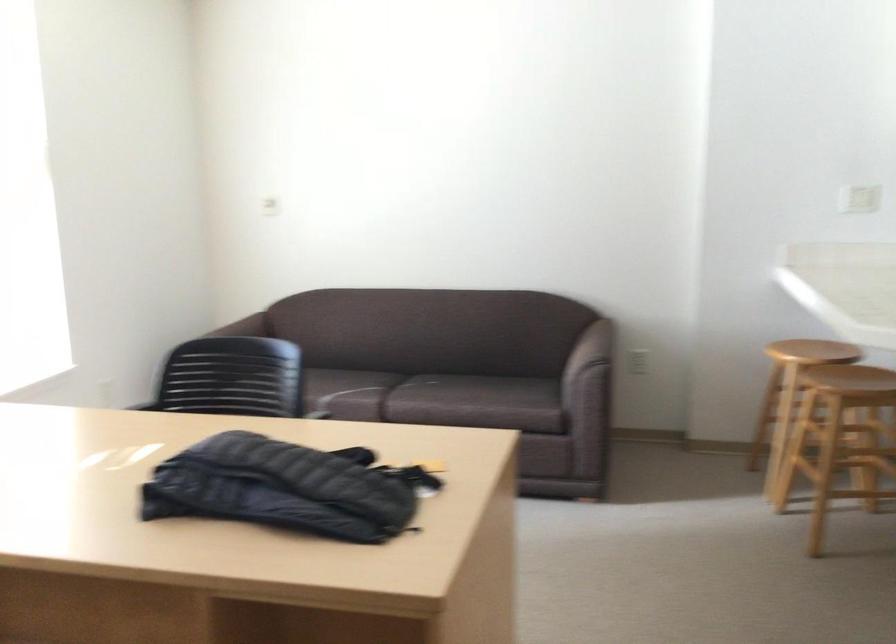
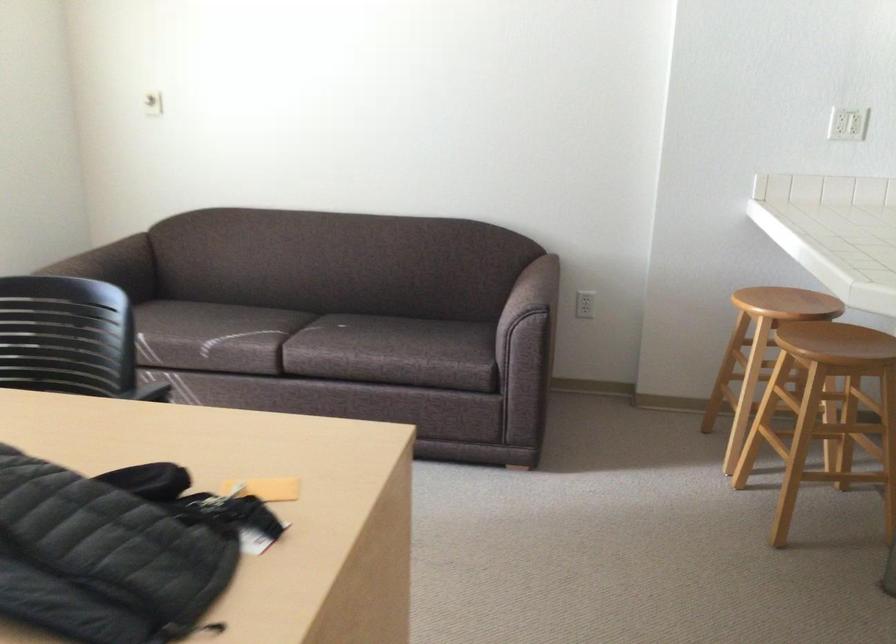
Question: In a continuous first-person perspective shot, in which direction is the camera moving?

Choices:
 (A) Left
 (B) Right
 (C) Forward
 (D) Backward

Answer: (C)